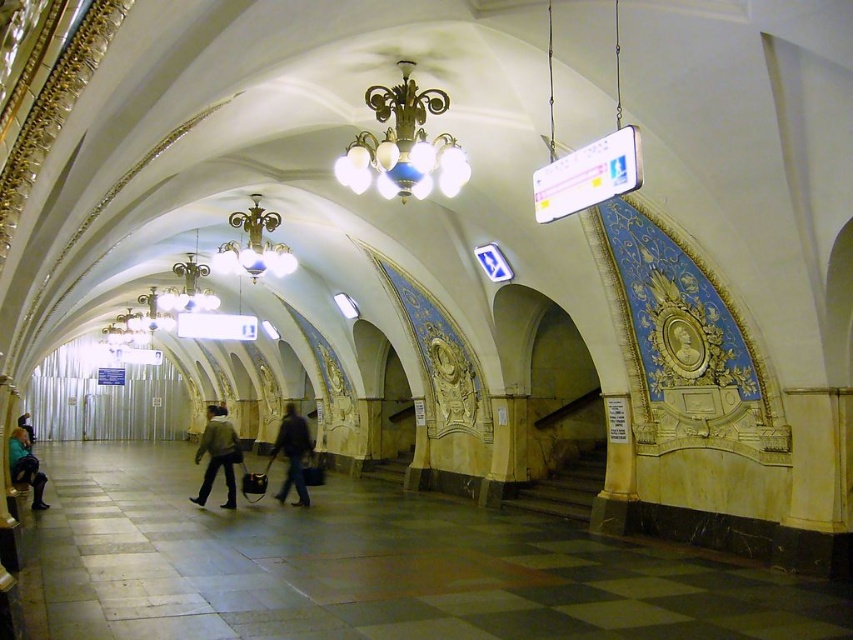
Question: Is dark blue jeans at center closer to camera compared to matte black jacket at lower left?

Choices:
 (A) yes
 (B) no

Answer: (B)

Question: Does light brown leather jacket at center have a larger size compared to matte black jacket at lower left?

Choices:
 (A) no
 (B) yes

Answer: (B)

Question: Which of these objects is positioned closest to the gold metallic chandelier at center?

Choices:
 (A) dark blue jeans at center
 (B) light brown leather jacket at center
 (C) metallic gold chandelier at center

Answer: (C)

Question: Where is dark blue jeans at center located in relation to matte black jacket at lower left in the image?

Choices:
 (A) above
 (B) below

Answer: (B)

Question: Which of the following is the closest to the observer?

Choices:
 (A) dark gray suit at center
 (B) light brown leather jacket at center
 (C) matte black jacket at lower left
 (D) dark blue jeans at center

Answer: (C)

Question: Which of the following is the farthest from the observer?

Choices:
 (A) light brown leather jacket at center
 (B) metallic gold chandelier at center

Answer: (A)